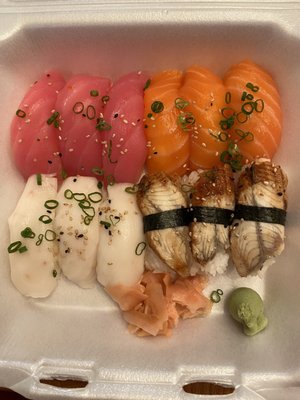
This screenshot has width=300, height=400. I want to click on table, so click(8, 396).